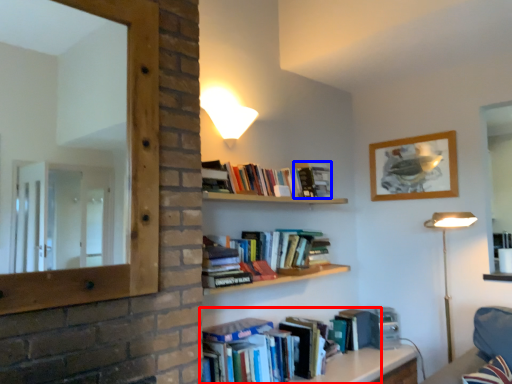
Question: Which object is further to the camera taking this photo, book (highlighted by a red box) or paperback book (highlighted by a blue box)?

Choices:
 (A) book
 (B) paperback book

Answer: (B)